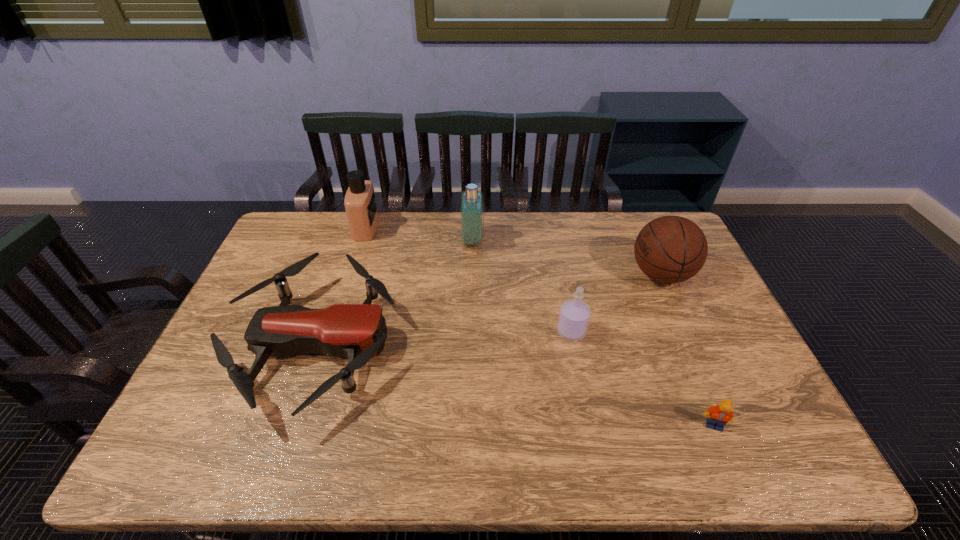
Find the location of a particular element. Image resolution: width=960 pixels, height=540 pixels. the leftmost perfume is located at coordinates (360, 204).

At what (x,y) coordinates should I click in order to perform the action: click on the third object from left to right. Please return your answer as a coordinate pair (x, y). Looking at the image, I should click on (471, 204).

This screenshot has width=960, height=540. I want to click on basketball, so click(671, 249).

This screenshot has width=960, height=540. In order to click on the fourth tallest object in this screenshot , I will do `click(574, 316)`.

Where is `the third object from right to left`? This screenshot has height=540, width=960. the third object from right to left is located at coordinates (574, 316).

Identify the location of drone. (357, 331).

Identify the location of Lego. Image resolution: width=960 pixels, height=540 pixels. pyautogui.click(x=719, y=415).

This screenshot has height=540, width=960. What are the coordinates of `vacant space located on the front label of the leftmost perfume` in the screenshot? It's located at (440, 228).

You are a GUI agent. You are given a task and a screenshot of the screen. Output one action in this format:
    pyautogui.click(x=<x>, y=<y>)
    Task: Click on the free point located on the front label of the second perfume from left to right
    The image size is (960, 540).
    Given the screenshot: What is the action you would take?
    pyautogui.click(x=595, y=240)

Identify the location of free space located 0.330m on the side with brand label of the basketball. This screenshot has width=960, height=540. [528, 274].